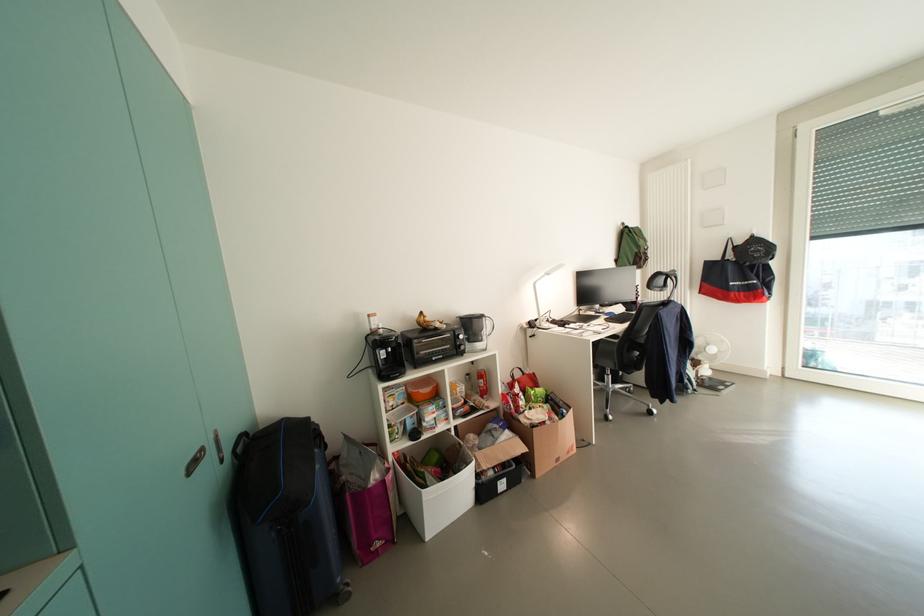
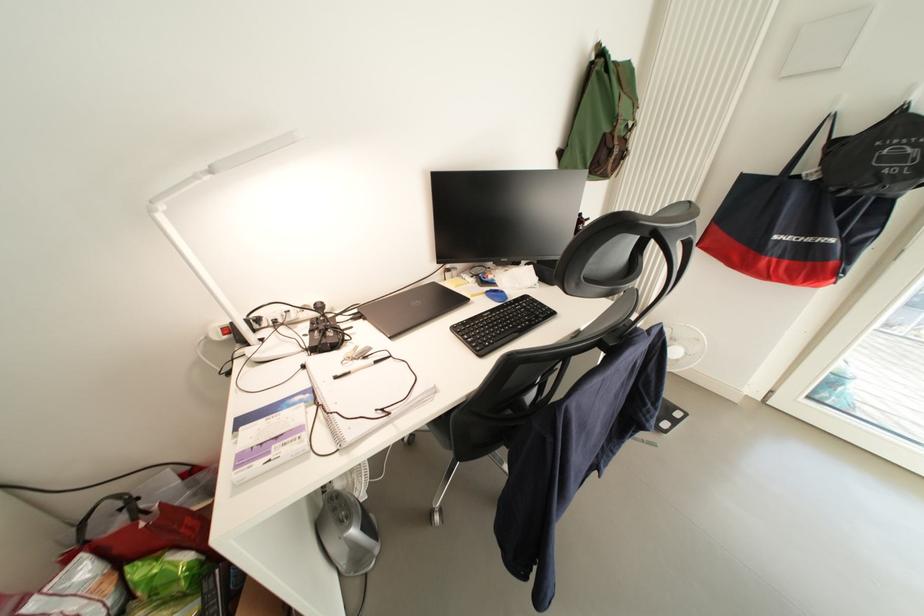
What movement of the cameraman would produce the second image?

The cameraman moved toward right, forward.